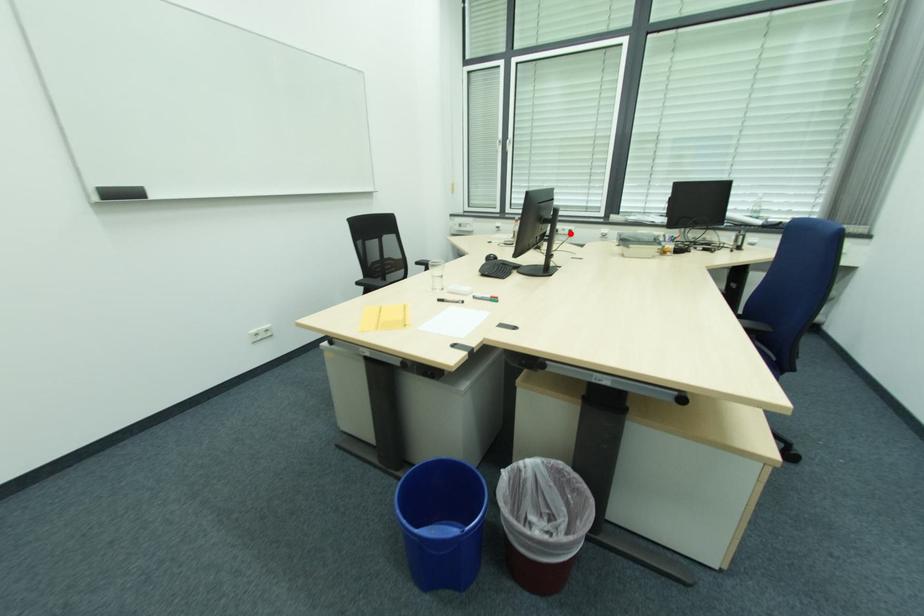
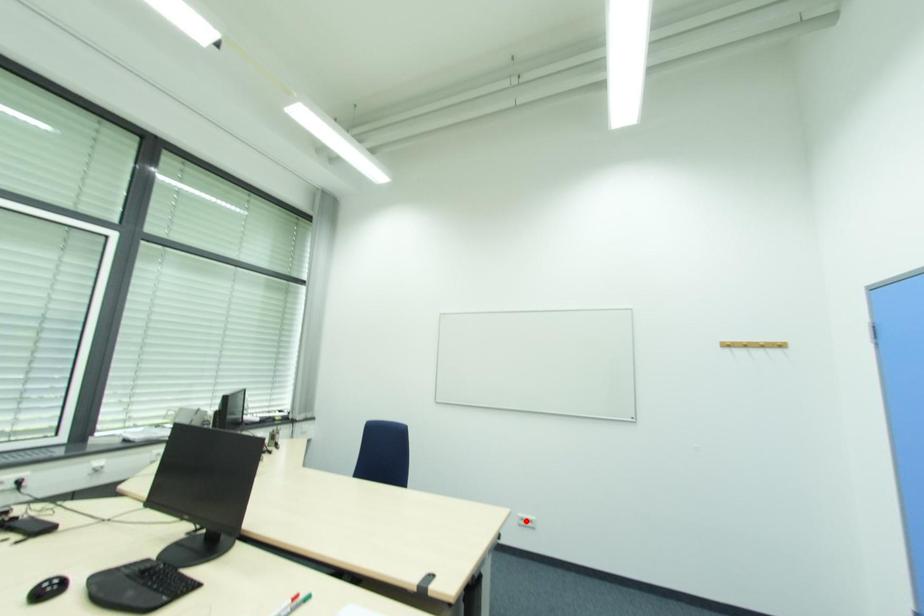
I am providing you with two images of the same scene from different viewpoints. A red point is marked on the first image and another point is marked on the second image. Does the point marked in image1 correspond to the same location as the one in image2?

No